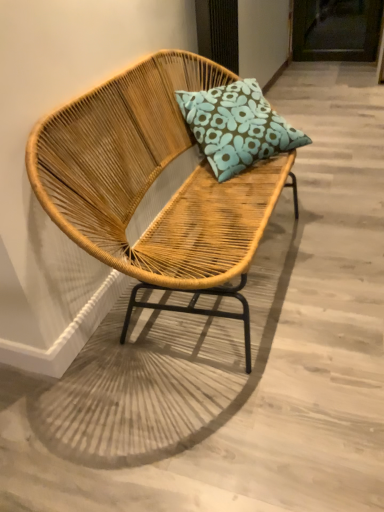
I want to click on vacant space in front of bamboo woven chair at center, so click(x=233, y=415).